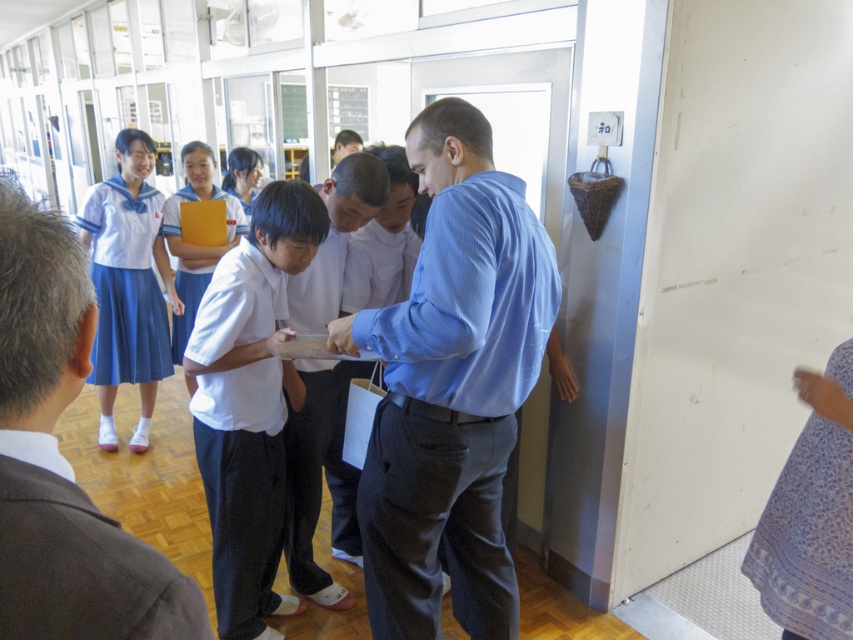
Question: Is white cotton school uniform at lower left to the left of white uniform skirt at left from the viewer's perspective?

Choices:
 (A) yes
 (B) no

Answer: (B)

Question: Which point is closer to the camera?

Choices:
 (A) blue printed fabric skirt at lower right
 (B) white cotton school uniform at lower left
 (C) white matte uniform at center
 (D) blue striped shirt at center

Answer: (B)

Question: Which of the following is the farthest from the observer?

Choices:
 (A) blue striped shirt at center
 (B) white cotton school uniform at lower left

Answer: (A)

Question: Which object is the closest to the white matte uniform at upper left?

Choices:
 (A) white matte uniform at center
 (B) white cotton school uniform at lower left
 (C) white uniform skirt at left
 (D) light blue striped shirt at center

Answer: (B)

Question: Does white matte uniform at upper left appear on the right side of light blue striped shirt at center?

Choices:
 (A) yes
 (B) no

Answer: (A)

Question: Can you confirm if white cotton school uniform at lower left is positioned to the left of light blue striped shirt at center?

Choices:
 (A) no
 (B) yes

Answer: (A)